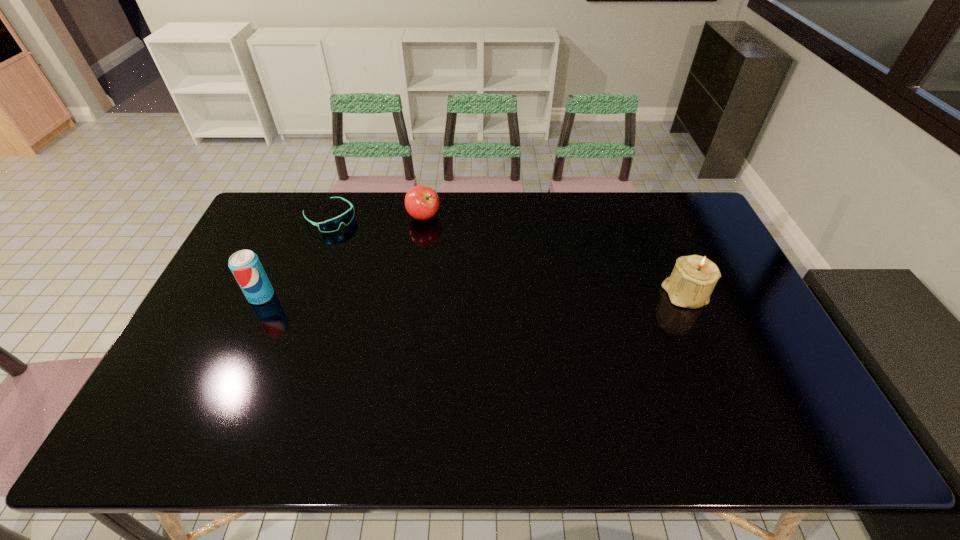
Locate an element on the screen. Image resolution: width=960 pixels, height=540 pixels. free space at the right edge of the desktop is located at coordinates (739, 363).

What are the coordinates of `free spot at the far left corner of the desktop` in the screenshot? It's located at (296, 227).

Where is `vacant area at the far right corner of the desktop`? vacant area at the far right corner of the desktop is located at coordinates (679, 199).

In the image, there is a desktop. Identify the location of vacant space at the near right corner. (746, 386).

Find the location of `free spot between the shortest object and the soda can`. free spot between the shortest object and the soda can is located at coordinates (296, 256).

Identify the location of free space between the candle_holder and the shortest object. (507, 256).

Locate an element on the screen. vacant space that's between the sunglasses and the second shortest object is located at coordinates (376, 217).

You are a GUI agent. You are given a task and a screenshot of the screen. Output one action in this format:
    pyautogui.click(x=<x>, y=<y>)
    Task: Click on the free point between the apple and the rightmost object
    This screenshot has height=540, width=960.
    Given the screenshot: What is the action you would take?
    pyautogui.click(x=554, y=255)

Where is `empty location between the apple and the soda can`? This screenshot has width=960, height=540. empty location between the apple and the soda can is located at coordinates (343, 256).

Identify the location of free space that is in between the shortest object and the apple. The width and height of the screenshot is (960, 540). (376, 217).